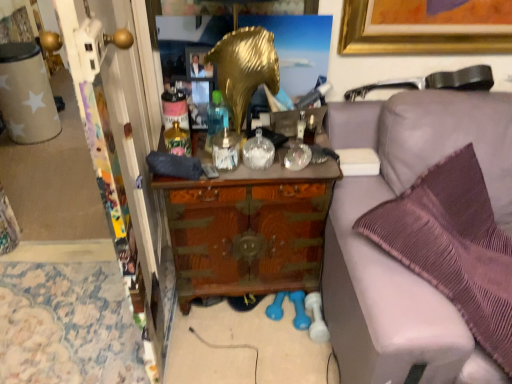
Find the location of a particular element. This screenshot has width=512, height=384. free space in front of wooden chest at center is located at coordinates click(242, 345).